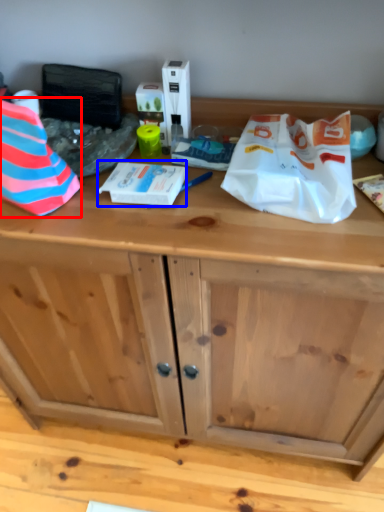
Question: Which object appears farthest to the camera in this image, wrapping paper (highlighted by a red box) or wrapping paper (highlighted by a blue box)?

Choices:
 (A) wrapping paper
 (B) wrapping paper

Answer: (B)